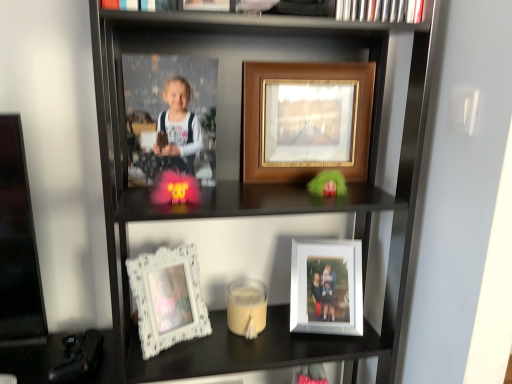
Image resolution: width=512 pixels, height=384 pixels. What do you see at coordinates (246, 307) in the screenshot?
I see `white matte candle at center` at bounding box center [246, 307].

Measure the distance between point (311, 287) and camera.

Point (311, 287) is 3.44 feet from camera.

This screenshot has width=512, height=384. Find the location of `white matte candle at center`. white matte candle at center is located at coordinates (246, 307).

From the image's perspective, which is above, white matte candle at center or matte black book at upper center?

matte black book at upper center.

Based on the photo, is white matte candle at center looking in the opposite direction of matte black book at upper center?

No, white matte candle at center's orientation is not away from matte black book at upper center.

Does white matte candle at center have a lesser width compared to matte black book at upper center?

No, white matte candle at center is not thinner than matte black book at upper center.

Is fuzzy pink toy at center oriented away from white ornate frame at lower left, the first picture frame in the left-to-right sequence?

No, fuzzy pink toy at center is not facing away from white ornate frame at lower left, the first picture frame in the left-to-right sequence.

Between fuzzy pink toy at center and white ornate frame at lower left, the 3th picture frame when ordered from right to left, which one is positioned behind?

white ornate frame at lower left, the 3th picture frame when ordered from right to left.

Is fuzzy pink toy at center thinner than white ornate frame at lower left, which is the first picture frame from bottom to top?

No, fuzzy pink toy at center is not thinner than white ornate frame at lower left, which is the first picture frame from bottom to top.

Are fuzzy pink toy at center and white ornate frame at lower left, the 3th picture frame when ordered from right to left, making contact?

No, fuzzy pink toy at center is not with white ornate frame at lower left, the 3th picture frame when ordered from right to left.

How different are the orientations of matte black book at upper center and wooden framed photo at center, the 2th picture frame when ordered from right to left, in degrees?

matte black book at upper center and wooden framed photo at center, the 2th picture frame when ordered from right to left, are facing 5.92 degrees away from each other.

From a real-world perspective, is matte black book at upper center under wooden framed photo at center, marked as the third picture frame in a bottom-to-top arrangement?

No, from a real-world perspective, matte black book at upper center is not below wooden framed photo at center, marked as the third picture frame in a bottom-to-top arrangement.

Would you say matte black book at upper center contains wooden framed photo at center, marked as the third picture frame in a bottom-to-top arrangement?

No, wooden framed photo at center, marked as the third picture frame in a bottom-to-top arrangement, is not a part of matte black book at upper center.

Which of these two, matte black book at upper center or wooden framed photo at center, marked as the second picture frame in a left-to-right arrangement, is thinner?

matte black book at upper center.

This screenshot has width=512, height=384. I want to click on bookcase below the fuzzy pink toy at center (from the image's perspective), so point(238,219).

From their relative heights in the image, would you say fuzzy pink toy at center is taller or shorter than wooden framed picture at upper center?

Considering their sizes, fuzzy pink toy at center has less height than wooden framed picture at upper center.

Is fuzzy pink toy at center placed right next to wooden framed picture at upper center?

No, fuzzy pink toy at center is not next to wooden framed picture at upper center.

Is fuzzy pink toy at center positioned behind wooden framed picture at upper center?

Yes, fuzzy pink toy at center is further from the camera.

In the scene shown: Is wooden framed picture at upper center oriented away from white glossy photo frame at lower center, positioned as the first picture frame in right-to-left order?

That's right, wooden framed picture at upper center is facing away from white glossy photo frame at lower center, positioned as the first picture frame in right-to-left order.

Looking at this image, does wooden framed picture at upper center have a larger size compared to white glossy photo frame at lower center, positioned as the first picture frame in right-to-left order?

Indeed, wooden framed picture at upper center has a larger size compared to white glossy photo frame at lower center, positioned as the first picture frame in right-to-left order.

Measure the distance from wooden framed picture at upper center to white glossy photo frame at lower center, which appears as the second picture frame when ordered from the bottom.

wooden framed picture at upper center and white glossy photo frame at lower center, which appears as the second picture frame when ordered from the bottom, are 8.96 inches apart.

Looking at this image, from the image's perspective, would you say matte black book at upper center is shown under white matte candle at center?

Actually, matte black book at upper center appears above white matte candle at center in the image.

Is matte black book at upper center bigger than white matte candle at center?

Yes, matte black book at upper center is bigger than white matte candle at center.

Does point (387, 1) come behind point (241, 301)?

That is False.

Looking at this image, can you confirm if matte black book at upper center is wider than white matte candle at center?

In fact, matte black book at upper center might be narrower than white matte candle at center.

Is wooden framed picture at upper center positioned with its back to wooden framed photo at center, marked as the second picture frame in a left-to-right arrangement?

Absolutely, wooden framed picture at upper center is directed away from wooden framed photo at center, marked as the second picture frame in a left-to-right arrangement.

Who is taller, wooden framed picture at upper center or wooden framed photo at center, marked as the second picture frame in a left-to-right arrangement?

wooden framed picture at upper center is taller.

From a real-world perspective, is wooden framed picture at upper center under wooden framed photo at center, marked as the second picture frame in a left-to-right arrangement?

Yes.

Relative to wooden framed photo at center, marked as the third picture frame in a bottom-to-top arrangement, is wooden framed picture at upper center in front or behind?

wooden framed picture at upper center is positioned closer to the viewer than wooden framed photo at center, marked as the third picture frame in a bottom-to-top arrangement.

I want to click on book located above the white matte candle at center (from a real-world perspective), so click(x=380, y=10).

The image size is (512, 384). I want to click on toy that appears above the white ornate frame at lower left, which is the 3th picture frame from top to bottom (from the image's perspective), so click(175, 188).

Looking at this image, when comparing their distances from white glossy photo frame at lower center, which appears as the second picture frame when ordered from the bottom, does fuzzy pink toy at center or white matte candle at center seem closer?

white matte candle at center is positioned closer to the anchor white glossy photo frame at lower center, which appears as the second picture frame when ordered from the bottom.

When comparing their distances from matte black book at upper center, does wooden framed photo at center, placed as the 1th picture frame when sorted from top to bottom, or white ornate frame at lower left, which is the first picture frame from bottom to top, seem closer?

Based on the image, wooden framed photo at center, placed as the 1th picture frame when sorted from top to bottom, appears to be nearer to matte black book at upper center.

Looking at the image, which one is located closer to wooden framed picture at upper center, matte black book at upper center or white matte candle at center?

The object closer to wooden framed picture at upper center is white matte candle at center.

When comparing their distances from wooden framed photo at center, placed as the 1th picture frame when sorted from top to bottom, does white glossy photo frame at lower center, which appears as the second picture frame when ordered from the bottom, or white matte candle at center seem further?

Among the two, white matte candle at center is located further to wooden framed photo at center, placed as the 1th picture frame when sorted from top to bottom.

When comparing their distances from matte black book at upper center, does white matte candle at center or white ornate frame at lower left, the 3th picture frame when ordered from right to left, seem further?

The object further to matte black book at upper center is white ornate frame at lower left, the 3th picture frame when ordered from right to left.

Based on their spatial positions, is fuzzy pink toy at center or matte black book at upper center further from white matte candle at center?

matte black book at upper center.

Considering their positions, is fuzzy pink toy at center positioned further to wooden framed photo at center, marked as the third picture frame in a bottom-to-top arrangement, than white glossy photo frame at lower center, positioned as the first picture frame in right-to-left order?

fuzzy pink toy at center.

Looking at the image, which one is located closer to white matte candle at center, wooden framed photo at center, marked as the second picture frame in a left-to-right arrangement, or matte black book at upper center?

wooden framed photo at center, marked as the second picture frame in a left-to-right arrangement, is positioned closer to the anchor white matte candle at center.

This screenshot has width=512, height=384. Identify the location of bookcase located between fuzzy pink toy at center and white glossy photo frame at lower center, positioned as the second picture frame in top-to-bottom order, in the left-right direction. (238, 219).

The height and width of the screenshot is (384, 512). Identify the location of toy between white ornate frame at lower left, the first picture frame in the left-to-right sequence, and white glossy photo frame at lower center, positioned as the second picture frame in top-to-bottom order, in the horizontal direction. (175, 188).

This screenshot has height=384, width=512. I want to click on bookcase between matte black book at upper center and white glossy photo frame at lower center, placed as the third picture frame when sorted from left to right, from top to bottom, so click(x=238, y=219).

The height and width of the screenshot is (384, 512). What are the coordinates of `bookcase between matte black book at upper center and white ornate frame at lower left, the first picture frame in the left-to-right sequence, from top to bottom` in the screenshot? It's located at (238, 219).